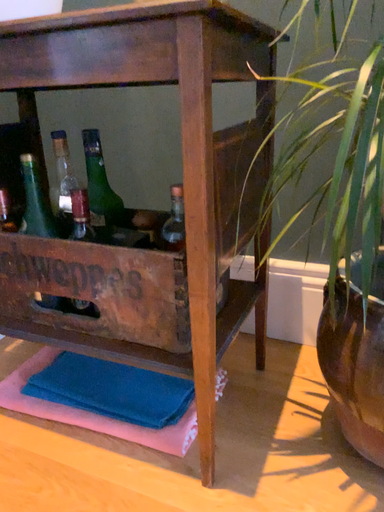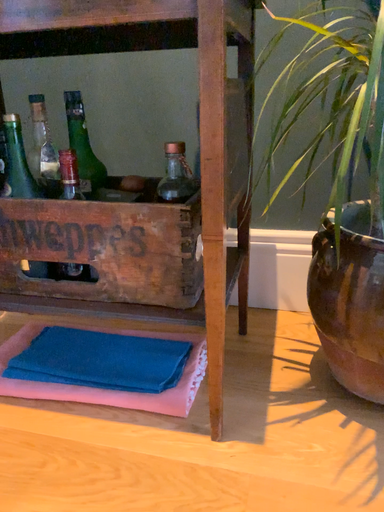
Question: Which way did the camera rotate in the video?

Choices:
 (A) rotated right
 (B) rotated left

Answer: (A)